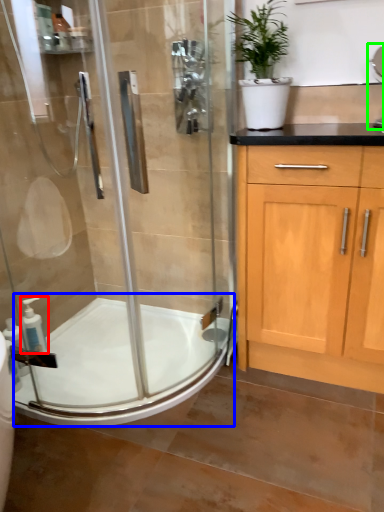
Question: Based on their relative distances, which object is farther from soap dispenser (highlighted by a red box)? Choose from bath (highlighted by a blue box) and sink (highlighted by a green box).

Choices:
 (A) bath
 (B) sink

Answer: (B)